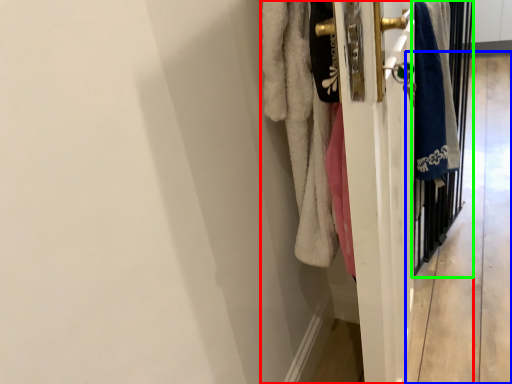
Question: Which is farther away from closet (highlighted by a red box)? corridor (highlighted by a blue box) or screen door (highlighted by a green box)?

Choices:
 (A) corridor
 (B) screen door

Answer: (A)